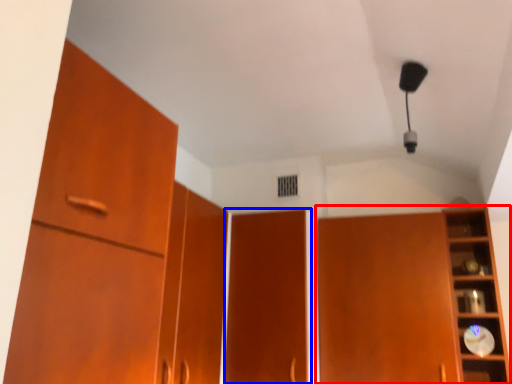
Question: Which of the following is the closest to the observer, cupboard (highlighted by a red box) or door (highlighted by a blue box)?

Choices:
 (A) cupboard
 (B) door

Answer: (A)